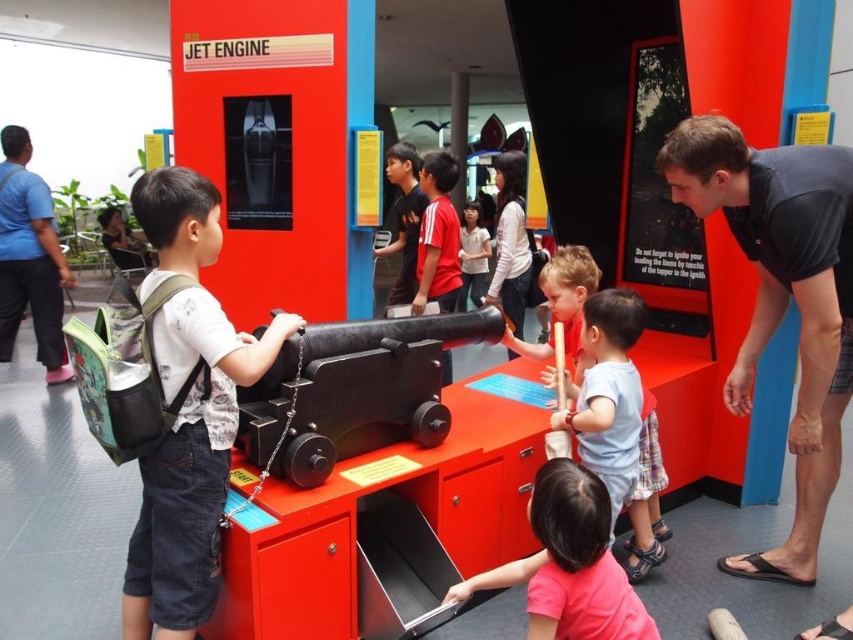
You are a visitor at the science museum and want to take a photo of the white matte shirt at center without the matte black backpack at left blocking the view. Is there a position you can stand where the backpack won

The matte black backpack at left is to the left of the white matte shirt at center. To avoid the backpack blocking the view, you should position yourself to the right side of the white matte shirt at center so that the backpack is out of frame to the left.

In the scene shown: A child is standing at the cannon and pulls a lever. There is a point located at coordinates point (589,556). If the child wants to move to this point, will they have to walk more than 6 feet?

The distance between the child and the point (589,556) is 5.93 feet, which is less than 6 feet. Therefore, the child will not have to walk more than 6 feet to reach the point.

You are a museum security guard. You need to ensure that the matte black backpack at left and the matte black shirt at center are not blocking the emergency exit sign. Given that the emergency exit sign is located to the right of both objects, which object is closer to the sign and might be a potential obstruction?

The matte black shirt at center is closer to the emergency exit sign because it is located to the right of both objects. Since the backpack is at the left and the shirt is at the center, the shirt is nearer to the sign on the right side. However, the description states that the backpack is wider than the shirt, so even if the shirt is closer, the backpack might still block the sign if its larger width extends towards the right. But based on their positions, the shirt is closer.